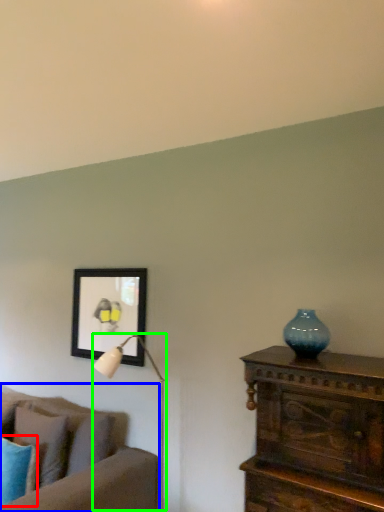
Question: Which object is positioned farthest from pillow (highlighted by a red box)? Select from studio couch (highlighted by a blue box) and table lamp (highlighted by a green box).

Choices:
 (A) studio couch
 (B) table lamp

Answer: (B)